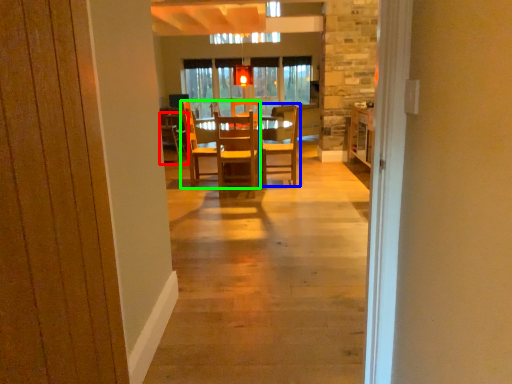
Question: Which is nearer to the chair (highlighted by a red box)? chair (highlighted by a blue box) or chair (highlighted by a green box).

Choices:
 (A) chair
 (B) chair

Answer: (B)